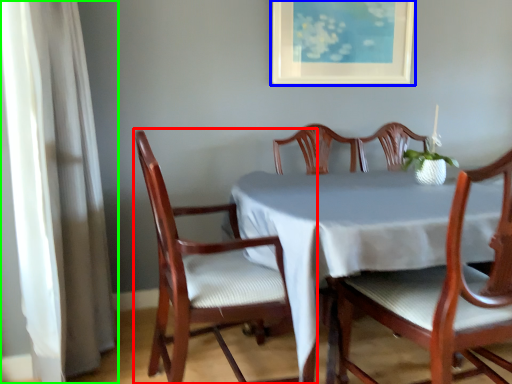
Question: Which is farther away from chair (highlighted by a red box)? picture frame (highlighted by a blue box) or curtain (highlighted by a green box)?

Choices:
 (A) picture frame
 (B) curtain

Answer: (A)